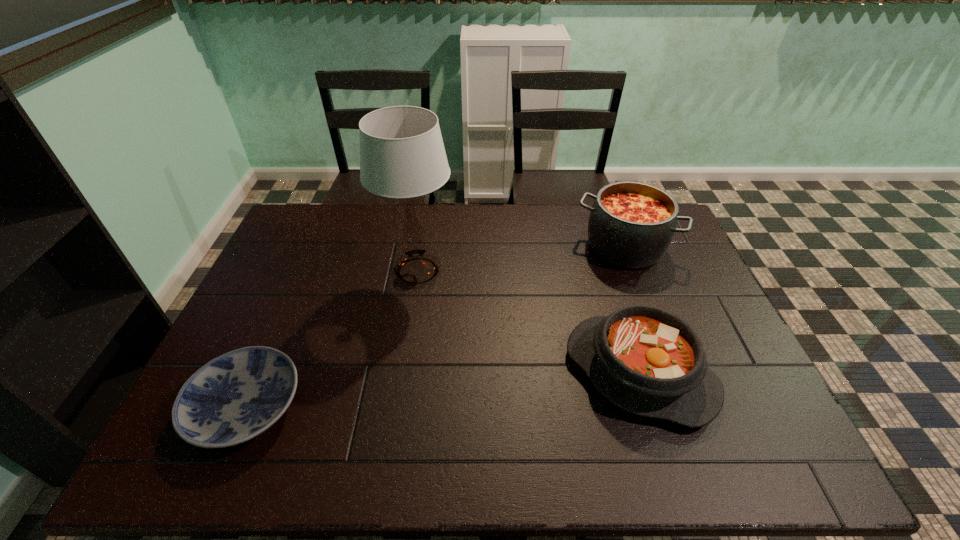
This screenshot has height=540, width=960. I want to click on vacant area that lies between the shortest object and the shorter casserole, so click(x=443, y=390).

I want to click on empty location between the second object from left to right and the second shortest object, so click(528, 322).

Find the location of a particular element. object that is the second closest to the leftmost object is located at coordinates (645, 360).

The image size is (960, 540). I want to click on the second closest object relative to the shortest object, so click(645, 360).

Locate an element on the screen. The height and width of the screenshot is (540, 960). free space that satisfies the following two spatial constraints: 1. on the back side of the shorter casserole; 2. on the front-facing side of the second object from left to right is located at coordinates (608, 271).

The height and width of the screenshot is (540, 960). Find the location of `blank area in the image that satisfies the following two spatial constraints: 1. on the front-facing side of the table lamp; 2. on the left side of the shorter casserole`. blank area in the image that satisfies the following two spatial constraints: 1. on the front-facing side of the table lamp; 2. on the left side of the shorter casserole is located at coordinates (402, 373).

At what (x,y) coordinates should I click in order to perform the action: click on free space that satisfies the following two spatial constraints: 1. on the front-facing side of the second object from left to right; 2. on the back side of the shorter casserole. Please return your answer as a coordinate pair (x, y). The image size is (960, 540). Looking at the image, I should click on (402, 373).